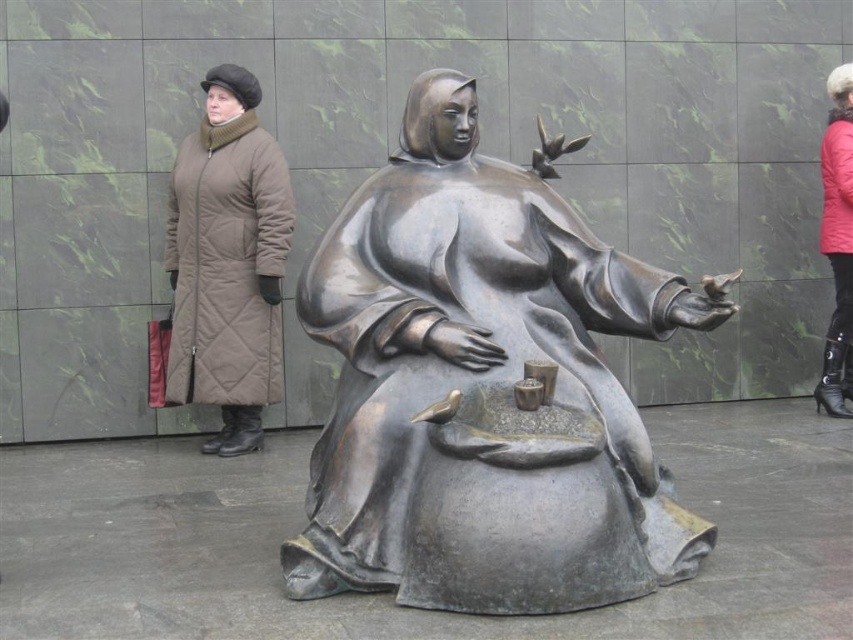
Between bronze statue at center and matte brown coat at left, which one appears on the left side from the viewer's perspective?

matte brown coat at left

Can you confirm if bronze statue at center is bigger than matte brown coat at left?

Correct, bronze statue at center is larger in size than matte brown coat at left.

What do you see at coordinates (485, 388) in the screenshot?
I see `bronze statue at center` at bounding box center [485, 388].

Where is `bronze statue at center`? bronze statue at center is located at coordinates (485, 388).

Can you confirm if matte brown coat at left is taller than red quilted coat at right?

No, matte brown coat at left is not taller than red quilted coat at right.

Is matte brown coat at left below red quilted coat at right?

Indeed, matte brown coat at left is positioned under red quilted coat at right.

Image resolution: width=853 pixels, height=640 pixels. In order to click on matte brown coat at left in this screenshot , I will do `click(227, 260)`.

Between point (480, 608) and point (837, 326), which one is positioned behind?

The point (837, 326) is behind.

Is point (543, 497) positioned in front of point (833, 179)?

That is True.

Where is `bronze statue at center`? The width and height of the screenshot is (853, 640). bronze statue at center is located at coordinates (485, 388).